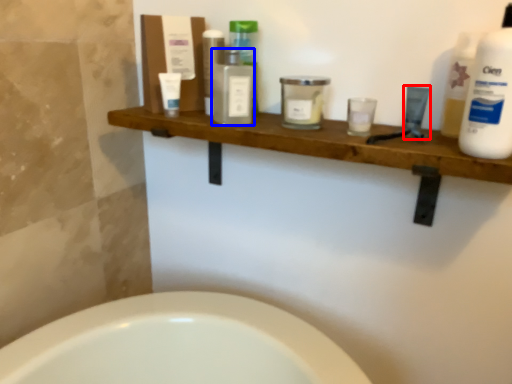
Question: Which of the following is the farthest to the observer, toiletry (highlighted by a red box) or toiletry (highlighted by a blue box)?

Choices:
 (A) toiletry
 (B) toiletry

Answer: (B)